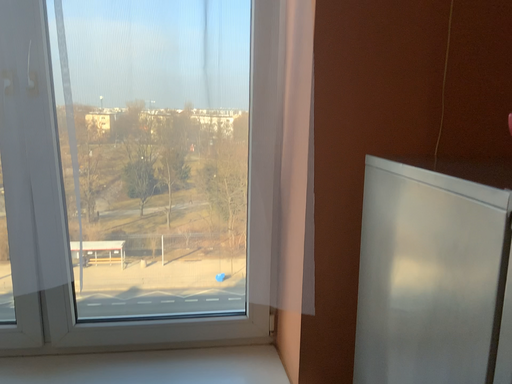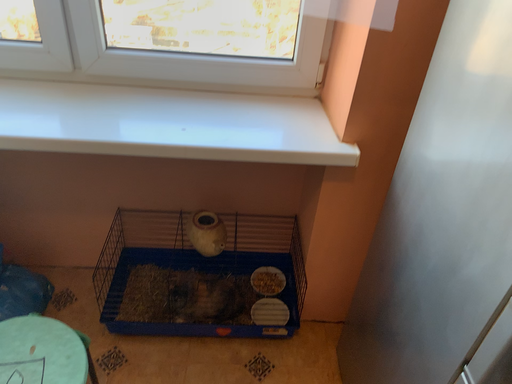
Question: How did the camera likely rotate when shooting the video?

Choices:
 (A) rotated upward
 (B) rotated downward

Answer: (B)